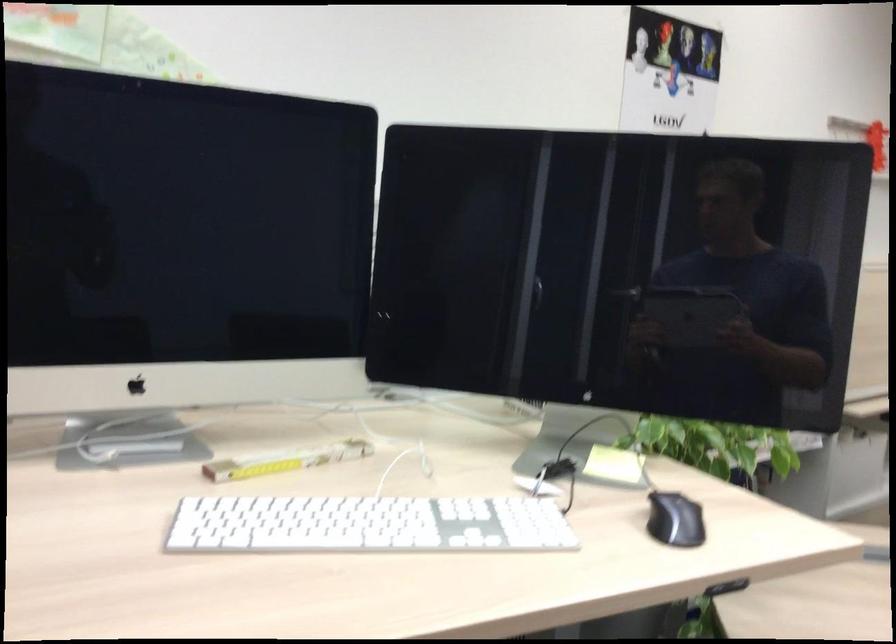
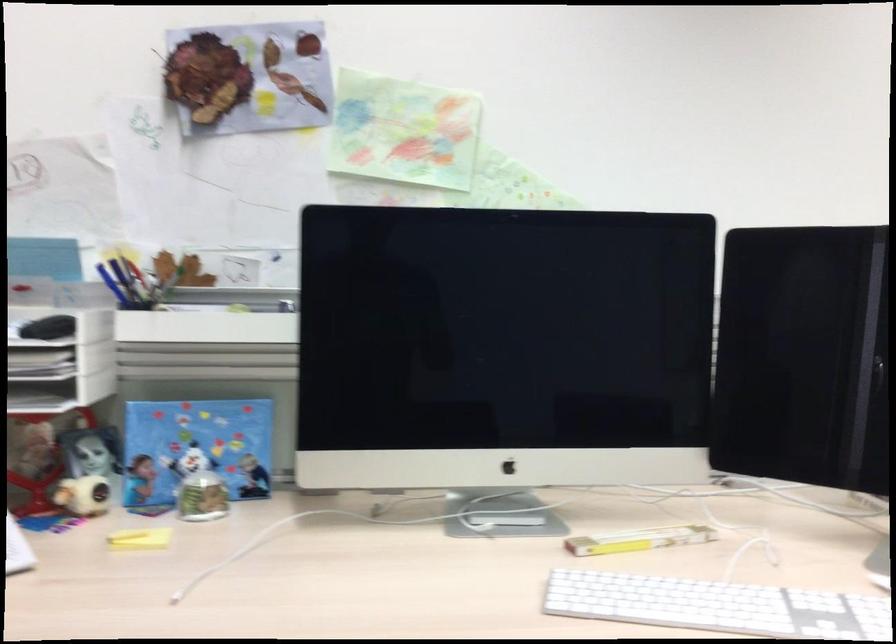
Find the pixel in the second image that matches point (73, 424) in the first image.

(449, 494)